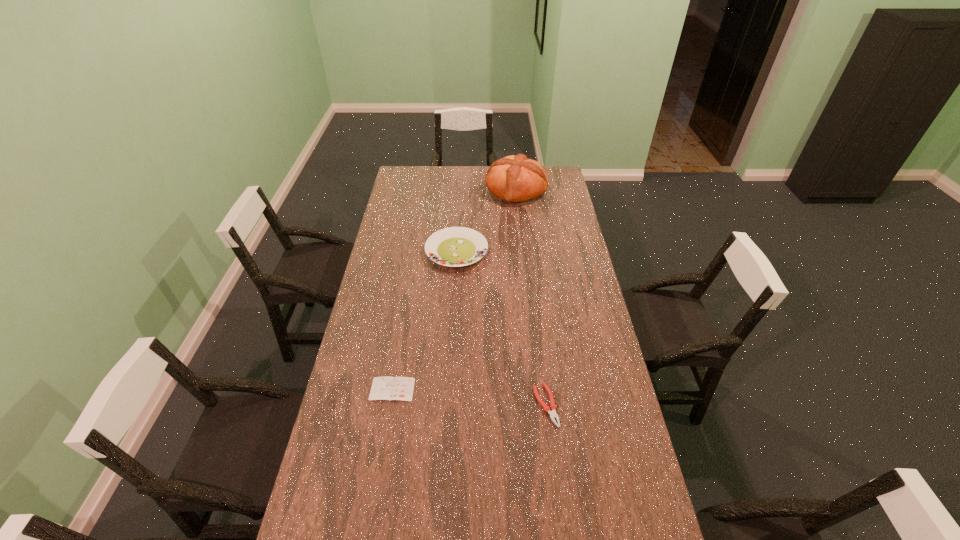
I want to click on bread, so click(x=514, y=178).

Locate an element on the screen. the farthest object is located at coordinates (514, 178).

Locate an element on the screen. the second farthest object is located at coordinates (455, 246).

Image resolution: width=960 pixels, height=540 pixels. What are the coordinates of `salad plate` in the screenshot? It's located at (455, 246).

Find the location of a particular element. The image size is (960, 540). the second shortest object is located at coordinates (553, 407).

At what (x,y) coordinates should I click in order to perform the action: click on the shortest object. Please return your answer as a coordinate pair (x, y). Looking at the image, I should click on (389, 388).

The image size is (960, 540). I want to click on vacant region located on the left of the farthest object, so click(x=465, y=190).

This screenshot has height=540, width=960. I want to click on free space located 0.240m on the back of the third shortest object, so click(460, 204).

Where is `free spot located 0.200m on the right of the second shortest object`? free spot located 0.200m on the right of the second shortest object is located at coordinates (619, 406).

The width and height of the screenshot is (960, 540). Find the location of `vacant space located on the front of the diary`. vacant space located on the front of the diary is located at coordinates (371, 517).